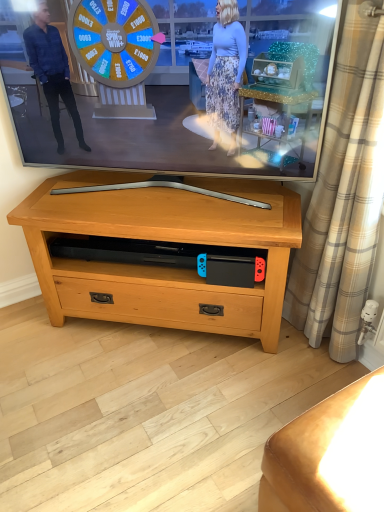
I want to click on free location above pine wood tv stand at center (from a real-world perspective), so click(x=139, y=192).